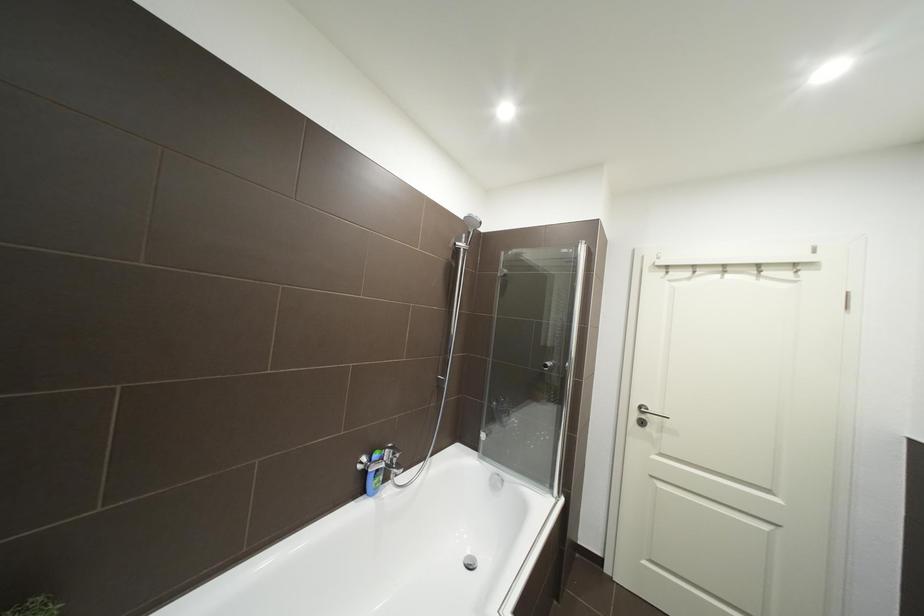
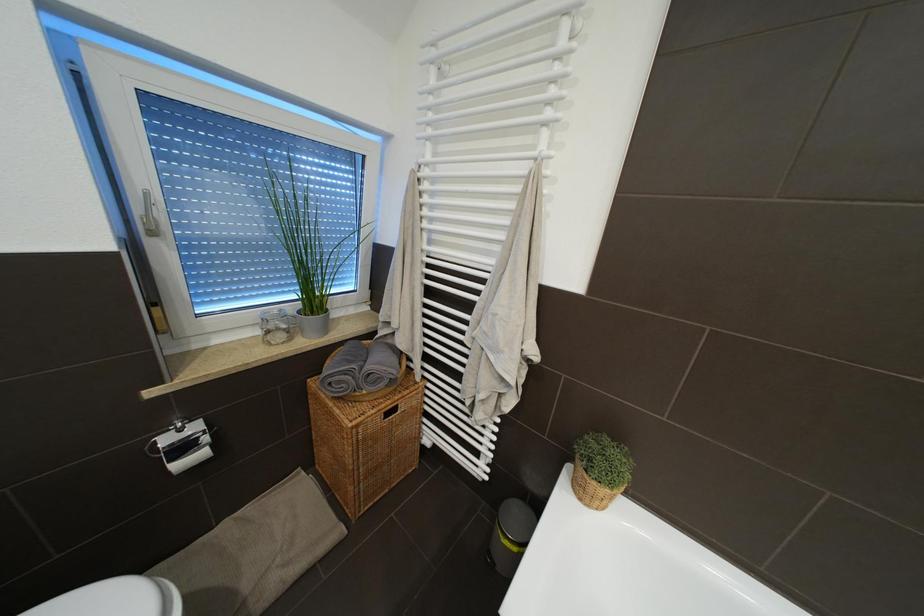
Question: How did the camera likely rotate?

Choices:
 (A) Left
 (B) Right
 (C) Up
 (D) Down

Answer: (A)